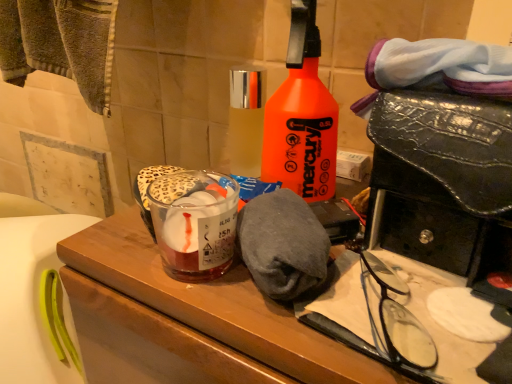
Question: From a real-world perspective, is orange matte spray bottle at center, the 1th bottle viewed from the right, positioned over clear glass bottle at center, acting as the second bottle starting from the right, based on gravity?

Choices:
 (A) no
 (B) yes

Answer: (B)

Question: Can you confirm if orange matte spray bottle at center, arranged as the second bottle when viewed from the left, is taller than clear glass bottle at center, acting as the 1th bottle starting from the left?

Choices:
 (A) no
 (B) yes

Answer: (B)

Question: From the image's perspective, is orange matte spray bottle at center, arranged as the second bottle when viewed from the left, located beneath clear glass bottle at center, acting as the second bottle starting from the right?

Choices:
 (A) yes
 (B) no

Answer: (B)

Question: Is orange matte spray bottle at center, arranged as the second bottle when viewed from the left, facing away from clear glass bottle at center, acting as the 1th bottle starting from the left?

Choices:
 (A) no
 (B) yes

Answer: (A)

Question: Could you tell me if orange matte spray bottle at center, arranged as the second bottle when viewed from the left, is turned towards clear glass bottle at center, acting as the second bottle starting from the right?

Choices:
 (A) no
 (B) yes

Answer: (A)

Question: Is wooden vanity at center in front of or behind translucent glass at center in the image?

Choices:
 (A) front
 (B) behind

Answer: (A)

Question: In terms of size, does wooden vanity at center appear bigger or smaller than translucent glass at center?

Choices:
 (A) big
 (B) small

Answer: (A)

Question: Choose the correct answer: Is wooden vanity at center inside translucent glass at center or outside it?

Choices:
 (A) outside
 (B) inside

Answer: (A)

Question: Is wooden vanity at center taller or shorter than translucent glass at center?

Choices:
 (A) tall
 (B) short

Answer: (A)

Question: From a real-world perspective, is clear glass bottle at center, acting as the 1th bottle starting from the left, above or below translucent glass at center?

Choices:
 (A) below
 (B) above

Answer: (B)

Question: Is clear glass bottle at center, acting as the second bottle starting from the right, spatially inside translucent glass at center, or outside of it?

Choices:
 (A) inside
 (B) outside

Answer: (B)

Question: In the image, is clear glass bottle at center, acting as the second bottle starting from the right, positioned in front of or behind translucent glass at center?

Choices:
 (A) front
 (B) behind

Answer: (B)

Question: Would you say clear glass bottle at center, acting as the second bottle starting from the right, is to the left or to the right of translucent glass at center in the picture?

Choices:
 (A) left
 (B) right

Answer: (B)

Question: In terms of height, does black plastic glasses at lower right look taller or shorter compared to wooden vanity at center?

Choices:
 (A) tall
 (B) short

Answer: (B)

Question: Is point pos(387,332) positioned closer to the camera than point pos(367,372)?

Choices:
 (A) closer
 (B) farther

Answer: (B)